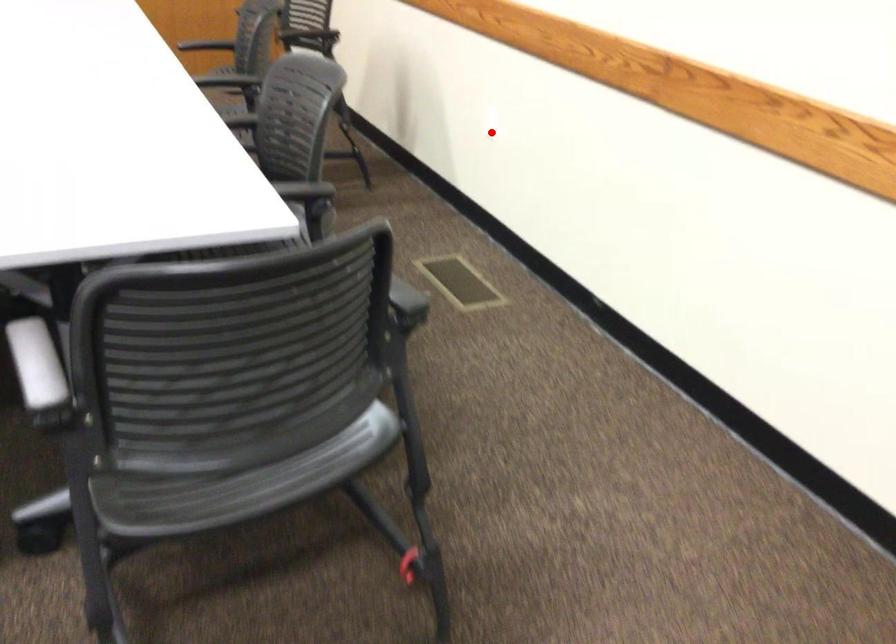
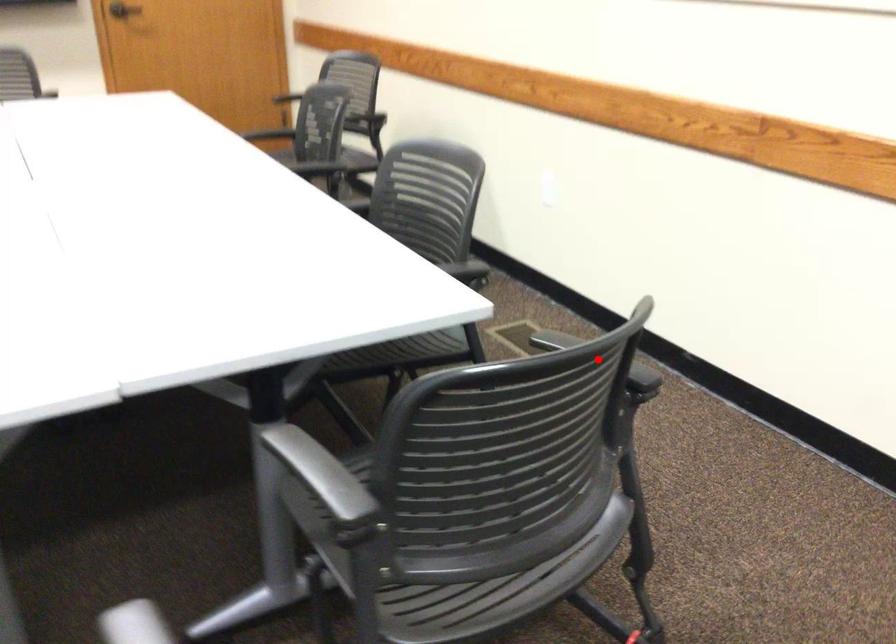
I am providing you with two images of the same scene from different viewpoints. A red point is marked on the first image and another point is marked on the second image. Is the red point in image1 aligned with the point shown in image2?

No